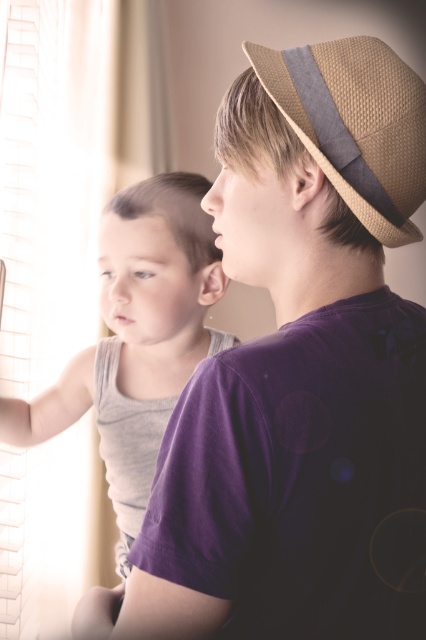
Where is `purple cotton shirt at upper right`? purple cotton shirt at upper right is located at coordinates (298, 362).

Is purple cotton shirt at upper right in front of braided straw hat at upper right?

Yes, it is.

The width and height of the screenshot is (426, 640). In order to click on purple cotton shirt at upper right in this screenshot , I will do `click(298, 362)`.

This screenshot has height=640, width=426. I want to click on purple cotton shirt at upper right, so click(x=298, y=362).

Does purple cotton shirt at upper right have a lesser width compared to gray cotton tank top at left?

Yes, purple cotton shirt at upper right is thinner than gray cotton tank top at left.

Describe the element at coordinates (298, 362) in the screenshot. I see `purple cotton shirt at upper right` at that location.

Find the location of a particular element. purple cotton shirt at upper right is located at coordinates (298, 362).

Between gray cotton tank top at left and braided straw hat at upper right, which one has less height?

Standing shorter between the two is braided straw hat at upper right.

Who is higher up, gray cotton tank top at left or braided straw hat at upper right?

braided straw hat at upper right is higher up.

Is point (138, 321) behind point (371, 83)?

Yes, point (138, 321) is behind point (371, 83).

The height and width of the screenshot is (640, 426). Identify the location of gray cotton tank top at left. (137, 339).